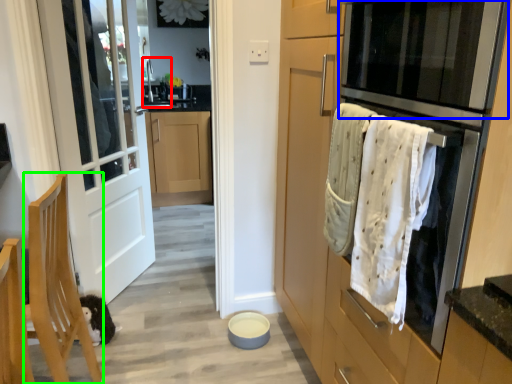
Question: Which object is the farthest from sink (highlighted by a red box)? Choose among these: oven (highlighted by a blue box) or chair (highlighted by a green box).

Choices:
 (A) oven
 (B) chair

Answer: (A)